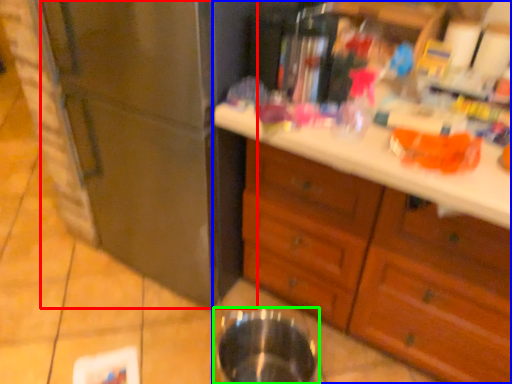
Question: Which object is positioned farthest from refrigerator (highlighted by a red box)? Select from cabinetry (highlighted by a blue box) and basin (highlighted by a green box).

Choices:
 (A) cabinetry
 (B) basin

Answer: (B)